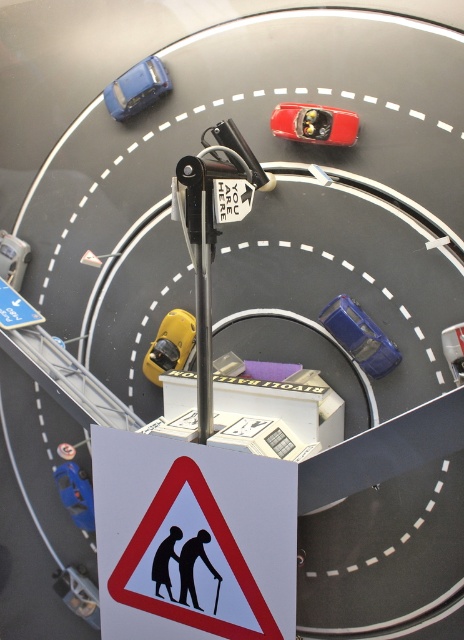
Question: Is yellow rubber toy car at center further to the viewer compared to white plastic pedestrian crossing sign at center?

Choices:
 (A) yes
 (B) no

Answer: (A)

Question: Does shiny blue car at center have a greater width compared to yellow rubber toy car at center?

Choices:
 (A) no
 (B) yes

Answer: (B)

Question: Is white paper sign at center to the right of shiny red car at upper center from the viewer's perspective?

Choices:
 (A) yes
 (B) no

Answer: (B)

Question: Which is nearer to the blue plastic toy car at lower left?

Choices:
 (A) yellow rubber toy car at center
 (B) shiny red car at upper center
 (C) white paper sign at center

Answer: (A)

Question: Among these objects, which one is farthest from the camera?

Choices:
 (A) yellow rubber toy car at center
 (B) blue plastic toy car at lower left

Answer: (B)

Question: Which object is farther from the camera taking this photo?

Choices:
 (A) matte blue car at upper left
 (B) shiny blue car at center

Answer: (A)